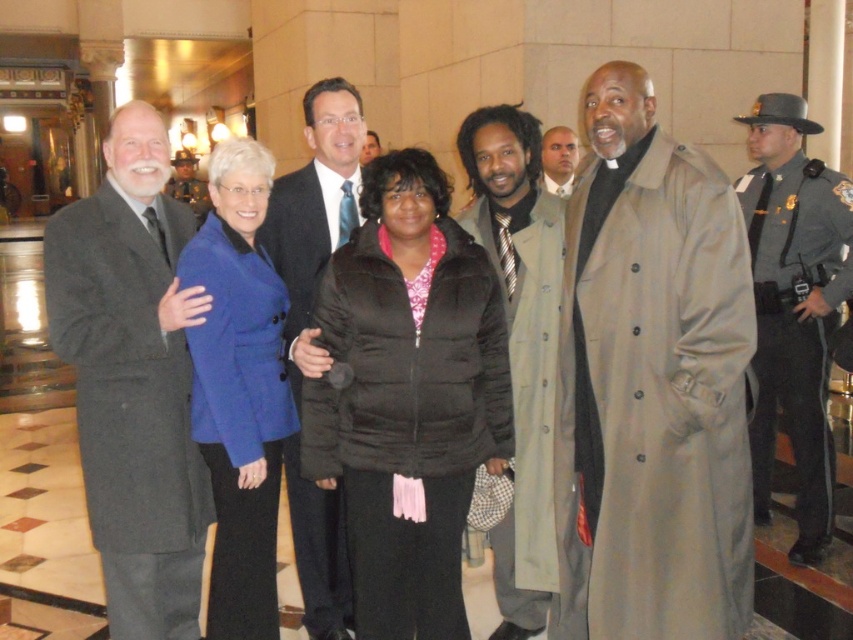
You are a photographer who needs to adjust the lighting between the light brown trench coat at center and the gray uniformed officer at right. Which object is positioned to the left of the other?

The light brown trench coat at center is to the left of the gray uniformed officer at right.

You are organizing a photo shoot and need to ensure that the light brown textured coat at center and the shiny blue suit at center fit within a rectangular frame. Based on the scene description, which object should be positioned closer to the edge of the frame to accommodate their sizes?

The light brown textured coat at center occupies less space than the shiny blue suit at center, so positioning the light brown textured coat at center closer to the edge of the frame would allow the shiny blue suit at center to have enough space within the rectangular frame.